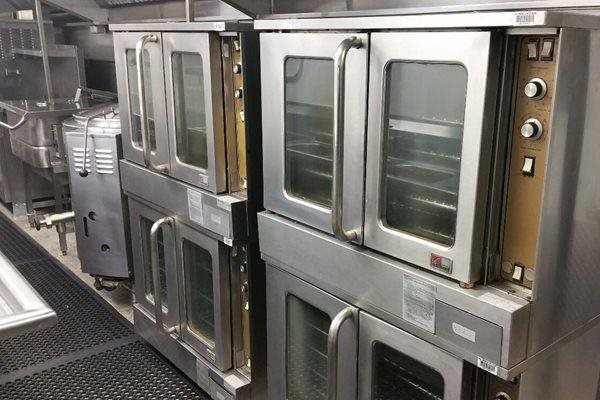
Locate an element on the screen. The image size is (600, 400). lower right oven is located at coordinates (369, 292).